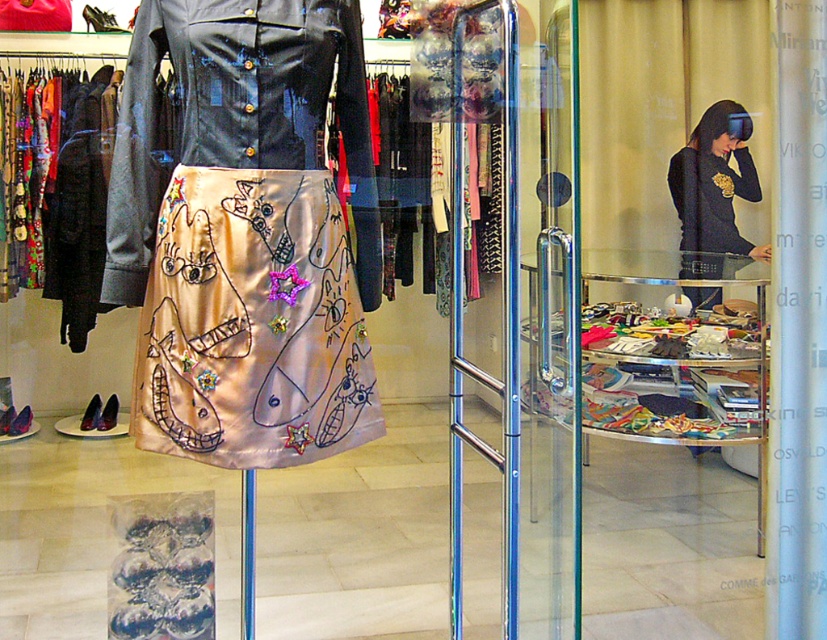
Question: Which of the following is the closest to the observer?

Choices:
 (A) (283, 168)
 (B) (151, 346)

Answer: (A)

Question: Can you confirm if shiny black jacket at center is bigger than black jersey at center?

Choices:
 (A) yes
 (B) no

Answer: (B)

Question: Based on their relative distances, which object is farther from the satin skirt at center?

Choices:
 (A) shiny black jacket at center
 (B) black jersey at center

Answer: (B)

Question: Can you confirm if shiny black jacket at center is smaller than black jersey at center?

Choices:
 (A) no
 (B) yes

Answer: (B)

Question: Which object appears closest to the camera in this image?

Choices:
 (A) shiny black jacket at center
 (B) satin skirt at center
 (C) black jersey at center

Answer: (A)

Question: Is satin skirt at center above black jersey at center?

Choices:
 (A) no
 (B) yes

Answer: (A)